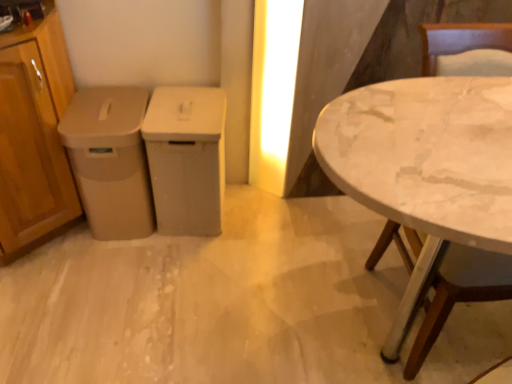
Question: Can you confirm if beige plastic trash can at left, which is counted as the 2th cabinetry, starting from the right, is wider than white marble table at right?

Choices:
 (A) yes
 (B) no

Answer: (B)

Question: Is white marble table at right completely or partially inside beige plastic trash can at left, which is counted as the 2th cabinetry, starting from the right?

Choices:
 (A) no
 (B) yes

Answer: (A)

Question: Is beige plastic trash can at left, the 2th cabinetry when ordered from left to right, further to the viewer compared to white marble table at right?

Choices:
 (A) no
 (B) yes

Answer: (B)

Question: Are beige plastic trash can at left, the 2th cabinetry when ordered from left to right, and white marble table at right making contact?

Choices:
 (A) no
 (B) yes

Answer: (A)

Question: Does beige plastic trash can at left, which is counted as the 2th cabinetry, starting from the right, have a greater height compared to white marble table at right?

Choices:
 (A) no
 (B) yes

Answer: (A)

Question: Is beige plastic trash can at left, which is counted as the 2th cabinetry, starting from the right, oriented away from white marble table at right?

Choices:
 (A) yes
 (B) no

Answer: (B)

Question: From a real-world perspective, is white marble table at right over wooden cabinet at left, the 3th cabinetry viewed from the right?

Choices:
 (A) no
 (B) yes

Answer: (A)

Question: From a real-world perspective, is white marble table at right under wooden cabinet at left, which ranks as the first cabinetry in left-to-right order?

Choices:
 (A) no
 (B) yes

Answer: (B)

Question: Is the surface of white marble table at right in direct contact with wooden cabinet at left, the 3th cabinetry viewed from the right?

Choices:
 (A) yes
 (B) no

Answer: (B)

Question: Can you confirm if white marble table at right is bigger than wooden cabinet at left, the 3th cabinetry viewed from the right?

Choices:
 (A) no
 (B) yes

Answer: (B)

Question: Considering the relative sizes of white marble table at right and wooden cabinet at left, which ranks as the first cabinetry in left-to-right order, in the image provided, is white marble table at right thinner than wooden cabinet at left, which ranks as the first cabinetry in left-to-right order,?

Choices:
 (A) no
 (B) yes

Answer: (A)

Question: Is white marble table at right far away from wooden cabinet at left, the 3th cabinetry viewed from the right?

Choices:
 (A) no
 (B) yes

Answer: (B)

Question: Considering the relative positions of wooden cabinet at left, the 3th cabinetry viewed from the right, and matte plastic trash can at center, the 3th cabinetry in the left-to-right sequence, in the image provided, is wooden cabinet at left, the 3th cabinetry viewed from the right, behind matte plastic trash can at center, the 3th cabinetry in the left-to-right sequence,?

Choices:
 (A) yes
 (B) no

Answer: (B)